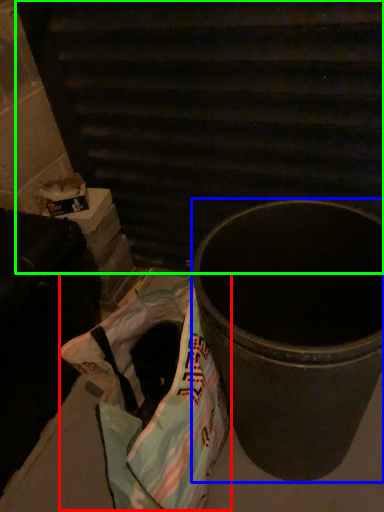
Question: Which object is positioned farthest from grocery bag (highlighted by a red box)? Select from waste container (highlighted by a blue box) and stairwell (highlighted by a green box).

Choices:
 (A) waste container
 (B) stairwell

Answer: (B)